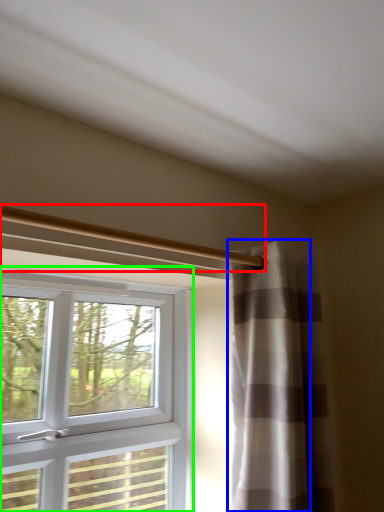
Question: Which object is the closest to the beam (highlighted by a red box)? Choose among these: curtain (highlighted by a blue box) or window (highlighted by a green box).

Choices:
 (A) curtain
 (B) window

Answer: (A)